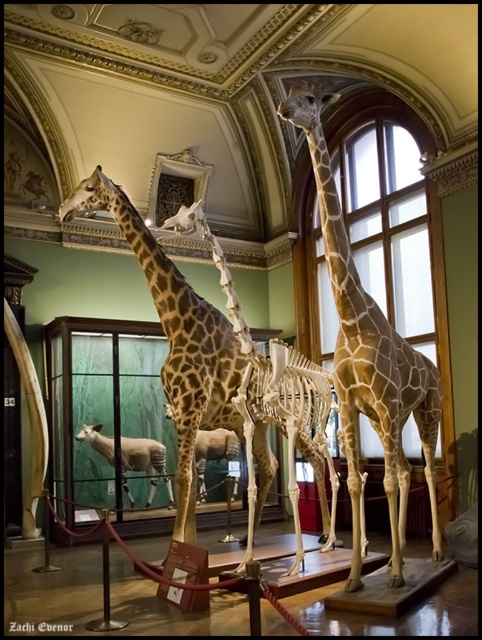
Question: Among these points, which one is farthest from the camera?

Choices:
 (A) (198, 497)
 (B) (145, 452)

Answer: (A)

Question: Which point is farther from the camera taking this photo?

Choices:
 (A) (306, 417)
 (B) (227, 458)
 (C) (181, 332)
 (D) (102, 451)

Answer: (B)

Question: Is brown spotted giraffe at center thinner than white woolen sheep at center?

Choices:
 (A) no
 (B) yes

Answer: (A)

Question: Observing the image, what is the correct spatial positioning of brown spotted skeleton at center in reference to white woolen sheep at center?

Choices:
 (A) left
 (B) right

Answer: (B)

Question: Considering the real-world distances, which object is closest to the brown spotted giraffe at center?

Choices:
 (A) white woolen sheep at center
 (B) light brown spotted giraffe at center
 (C) brown spotted skeleton at center
 (D) smooth brown giraffe at center

Answer: (C)

Question: Is brown spotted skeleton at center positioned at the back of white woolen sheep at center?

Choices:
 (A) no
 (B) yes

Answer: (A)